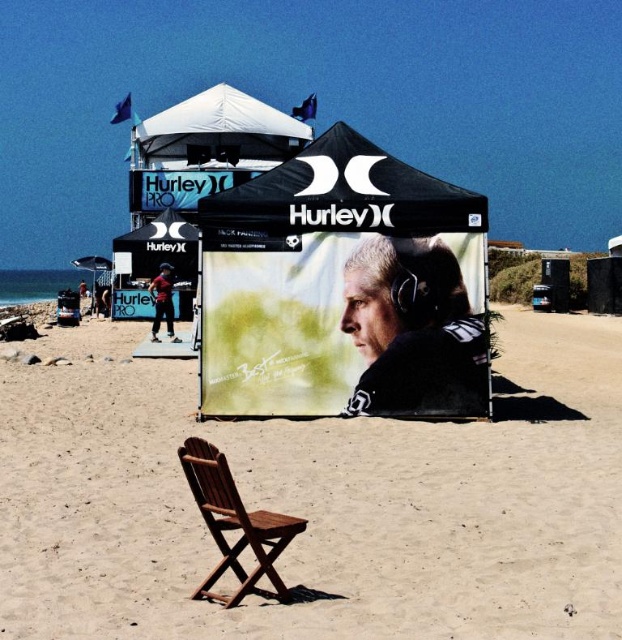
Does smooth skin portrait at center appear over wooden chair at center?

Correct, smooth skin portrait at center is located above wooden chair at center.

Can you confirm if smooth skin portrait at center is smaller than wooden chair at center?

Correct, smooth skin portrait at center occupies less space than wooden chair at center.

Where is `smooth skin portrait at center`? This screenshot has width=622, height=640. smooth skin portrait at center is located at coordinates (412, 330).

You are a GUI agent. You are given a task and a screenshot of the screen. Output one action in this format:
    pyautogui.click(x=<x>, y=<y>)
    Task: Click on the smooth skin portrait at center
    
    Given the screenshot: What is the action you would take?
    pyautogui.click(x=412, y=330)

Can you confirm if wooden chair at center is thinner than blue denim jeans at center?

No, wooden chair at center is not thinner than blue denim jeans at center.

Is wooden chair at center closer to camera compared to blue denim jeans at center?

Yes, wooden chair at center is in front of blue denim jeans at center.

The height and width of the screenshot is (640, 622). Find the location of `wooden chair at center`. wooden chair at center is located at coordinates (233, 522).

This screenshot has height=640, width=622. In order to click on wooden chair at center in this screenshot , I will do `click(233, 522)`.

Does black matte tent at center appear under white fabric canopy at upper center?

Yes.

Who is more forward, (x=256, y=266) or (x=221, y=102)?

Point (x=256, y=266) is more forward.

Image resolution: width=622 pixels, height=640 pixels. What do you see at coordinates (343, 289) in the screenshot?
I see `black matte tent at center` at bounding box center [343, 289].

You are a GUI agent. You are given a task and a screenshot of the screen. Output one action in this format:
    pyautogui.click(x=<x>, y=<y>)
    Task: Click on the black matte tent at center
    
    Given the screenshot: What is the action you would take?
    pyautogui.click(x=343, y=289)